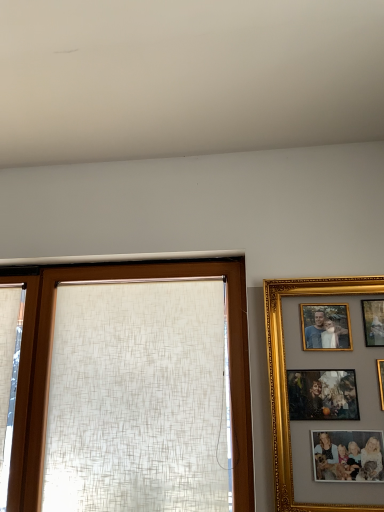
Question: Considering the positions of point (276, 306) and point (34, 487), is point (276, 306) closer or farther from the camera than point (34, 487)?

Choices:
 (A) farther
 (B) closer

Answer: (B)

Question: From their relative heights in the image, would you say gold/gilded picture frame at right is taller or shorter than matte beige curtain at center?

Choices:
 (A) short
 (B) tall

Answer: (A)

Question: Which object is the farthest from the matte beige curtain at center?

Choices:
 (A) gold/gilded picture frame at right
 (B) white textured curtain at left

Answer: (A)

Question: Estimate the real-world distances between objects in this image. Which object is farther from the matte beige curtain at center?

Choices:
 (A) gold/gilded picture frame at right
 (B) white textured curtain at left

Answer: (A)